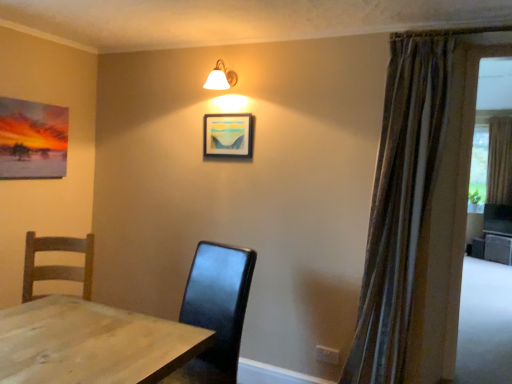
Question: Is white glass lamp at upper center wider than striped fabric curtain at right, the second curtain in the right-to-left sequence?

Choices:
 (A) yes
 (B) no

Answer: (B)

Question: Is white glass lamp at upper center to the left of striped fabric curtain at right, the second curtain in the right-to-left sequence, from the viewer's perspective?

Choices:
 (A) yes
 (B) no

Answer: (A)

Question: From a real-world perspective, is white glass lamp at upper center on striped fabric curtain at right, the 1th curtain positioned from the front?

Choices:
 (A) yes
 (B) no

Answer: (A)

Question: Can you confirm if white glass lamp at upper center is taller than striped fabric curtain at right, marked as the first curtain in a left-to-right arrangement?

Choices:
 (A) yes
 (B) no

Answer: (B)

Question: Is white glass lamp at upper center positioned far away from striped fabric curtain at right, the second curtain in the right-to-left sequence?

Choices:
 (A) yes
 (B) no

Answer: (A)

Question: Is the surface of white glass lamp at upper center in direct contact with striped fabric curtain at right, the second curtain from the back?

Choices:
 (A) yes
 (B) no

Answer: (B)

Question: Is white glass lamp at upper center behind brown textured curtain at right, positioned as the first curtain in right-to-left order?

Choices:
 (A) no
 (B) yes

Answer: (A)

Question: From a real-world perspective, is white glass lamp at upper center located beneath brown textured curtain at right, positioned as the first curtain in right-to-left order?

Choices:
 (A) no
 (B) yes

Answer: (A)

Question: From the image's perspective, is white glass lamp at upper center beneath brown textured curtain at right, positioned as the first curtain in right-to-left order?

Choices:
 (A) no
 (B) yes

Answer: (A)

Question: Considering the relative sizes of white glass lamp at upper center and brown textured curtain at right, acting as the 2th curtain starting from the front, in the image provided, is white glass lamp at upper center wider than brown textured curtain at right, acting as the 2th curtain starting from the front,?

Choices:
 (A) yes
 (B) no

Answer: (A)

Question: Does white glass lamp at upper center have a lesser height compared to brown textured curtain at right, which is counted as the second curtain, starting from the left?

Choices:
 (A) no
 (B) yes

Answer: (B)

Question: Can you confirm if white glass lamp at upper center is thinner than brown textured curtain at right, acting as the 2th curtain starting from the front?

Choices:
 (A) yes
 (B) no

Answer: (B)

Question: Does striped fabric curtain at right, marked as the first curtain in a left-to-right arrangement, appear on the left side of matte wooden picture frame at upper center?

Choices:
 (A) yes
 (B) no

Answer: (B)